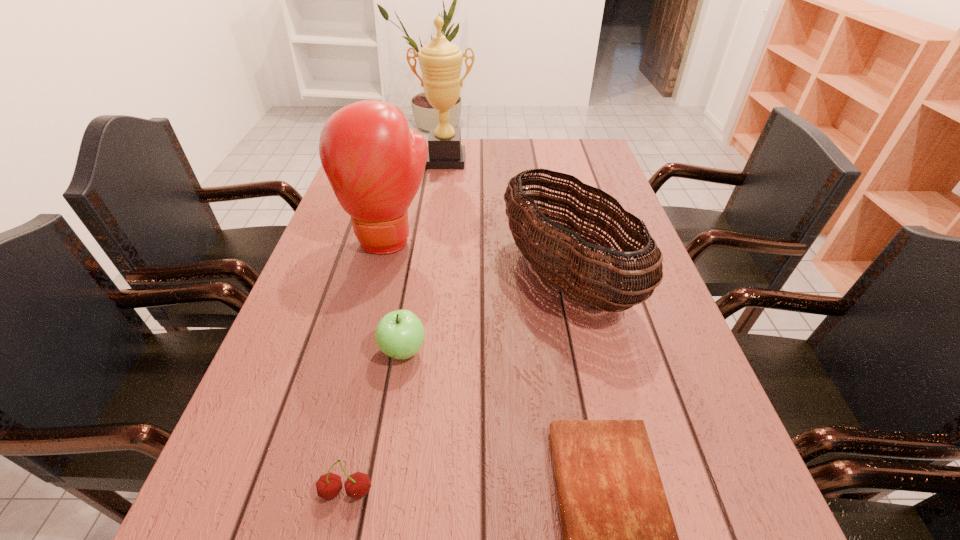
Where is `empty space between the apple and the trophy cup`? This screenshot has width=960, height=540. empty space between the apple and the trophy cup is located at coordinates (424, 256).

Locate an element on the screen. The height and width of the screenshot is (540, 960). vacant point located between the cherry and the apple is located at coordinates (374, 421).

Locate an element on the screen. The width and height of the screenshot is (960, 540). vacant space in between the fourth shortest object and the cherry is located at coordinates (456, 384).

The width and height of the screenshot is (960, 540). I want to click on the closest object relative to the boxing glove, so click(x=569, y=267).

Select which object appears as the third closest to the cherry. Please provide its 2D coordinates. Your answer should be formatted as a tuple, i.e. [(x, y)], where the tuple contains the x and y coordinates of a point satisfying the conditions above.

[(569, 267)]

The height and width of the screenshot is (540, 960). In order to click on vacant space that satisfies the following two spatial constraints: 1. at the front of the tallest object with handles; 2. on the right side of the basket in this screenshot , I will do [x=432, y=277].

Where is `vacant space that satisfies the following two spatial constraints: 1. on the striking surface of the second tallest object; 2. on the right side of the apple`? This screenshot has width=960, height=540. vacant space that satisfies the following two spatial constraints: 1. on the striking surface of the second tallest object; 2. on the right side of the apple is located at coordinates (361, 351).